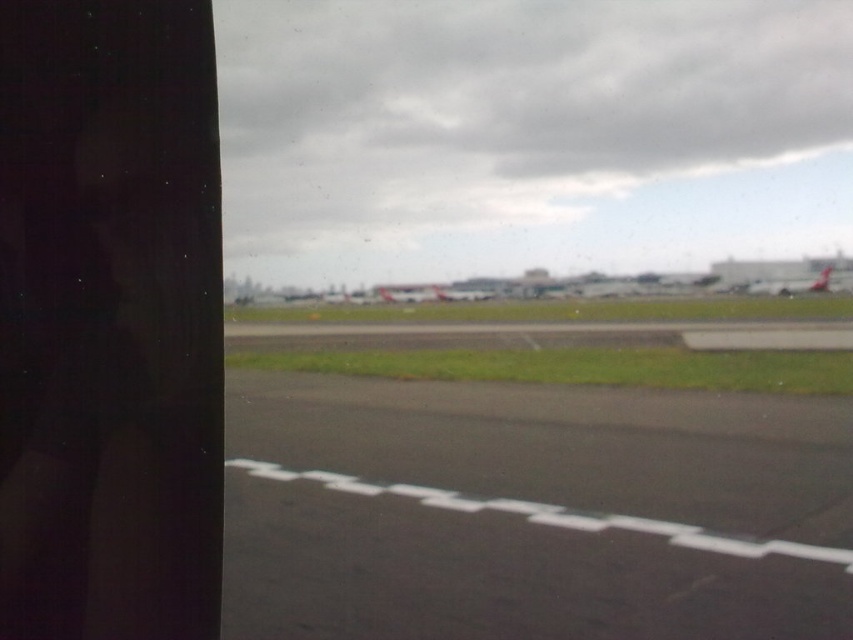
You are sitting inside an airplane and looking out the window. You see two points marked in the scene. The first point is at coordinates point (381,403) and the second point is at point (830,273). Which point is closer to you?

Point (381,403) is closer to the viewer than point (830,273).

You are a pilot preparing to taxi your plane to the runway. You see the black asphalt tarmac at center and the metallic silver airplane at right. Which one has a wider width?

The metallic silver airplane at right has a greater width than the black asphalt tarmac at center.

You are a passenger on an airplane and looking out the window. You notice the black asphalt tarmac at center and the metallic silver airplane at right. Which object is closer to your viewpoint?

The black asphalt tarmac at center is closer to your viewpoint because it is in front of the metallic silver airplane at right.